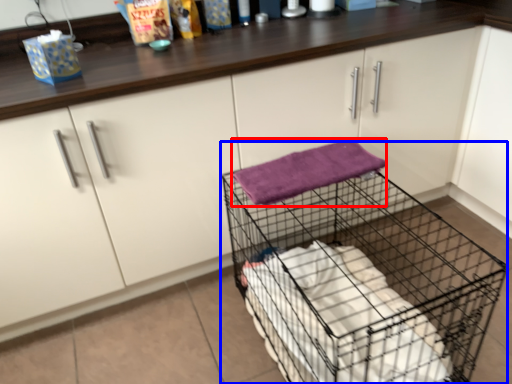
Question: Among these objects, which one is nearest to the camera, bath towel (highlighted by a red box) or trolley (highlighted by a blue box)?

Choices:
 (A) bath towel
 (B) trolley

Answer: (B)